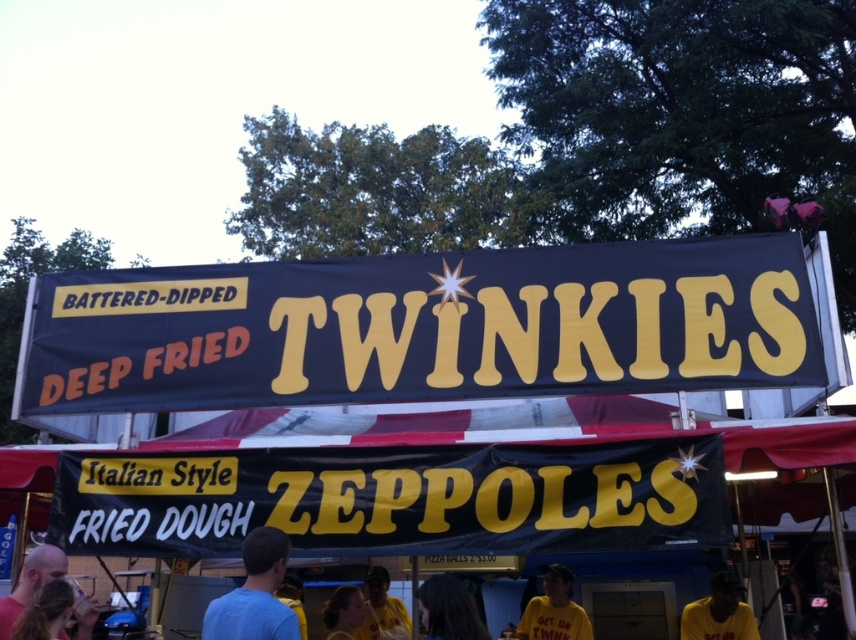
Based on the photo, you are standing at the entrance of the food stall and want to locate the black matte signboard at center. According to the coordinates provided, where should you look relative to your position?

The black matte signboard at center is located at point coordinates 0.780 on the x axis and 0.464 on the y axis. Since the x coordinate is closer to 1, it is positioned to the right side of the stall. The y coordinate being closer to 0.5 places it near the center vertically. So you should look towards the right center area of the stall.

You are a customer standing at the entrance of the food stall. You want to read the black matte signboard at center but notice a man with a smooth bald head at lower left blocking your view. Can you step aside to see the signboard without moving closer to it?

The distance between the black matte signboard at center and the smooth bald head at lower left is 4.73 feet. Since the man is blocking your view, stepping aside to the side might allow you to see around him as there is enough space between them.

You are a customer at the food stall and want to read both the black matte signboard at center and the smooth bald head at lower left. Which object is taller?

The black matte signboard at center is much taller than the smooth bald head at lower left.